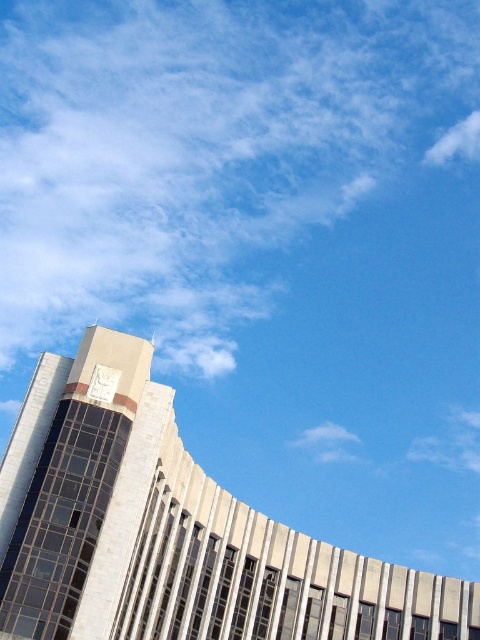
You are an architect reviewing the building design. You notice two elements at the upper left corner of the building. Which one is taller between the white stone tower at upper left and the metallic clock at upper left?

The white stone tower at upper left is much taller than the metallic clock at upper left.

You are an architect designing a new building and want to ensure that the white fluffy cloud at upper right and the metallic clock at upper left are balanced in terms of visual weight. Considering their sizes, which object should you adjust to achieve better symmetry?

Since the white fluffy cloud at upper right is wider than the metallic clock at upper left, you should reduce the width of the white fluffy cloud at upper right or increase the width of the metallic clock at upper left to achieve better symmetry.

You are standing at the base of the modern architectural structure. You notice two points marked on the building facade. The first point is at coordinate point (419, 163), and the second is at point (132, 600). From your vantage point, which point appears closer to you?

Point (132, 600) appears closer to you because it is in front of point (419, 163).